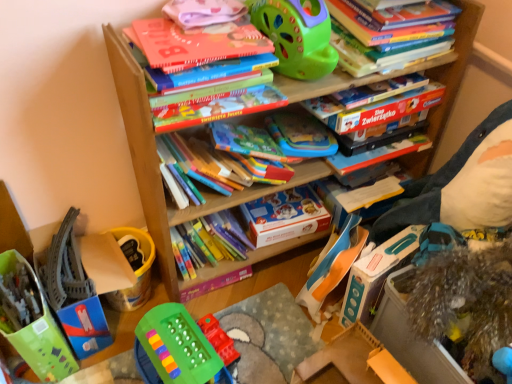
Question: Considering the positions of blue plastic toy at lower right, which is the 5th toy in left-to-right order, and green plastic toy at lower center, which is the fifth toy from right to left, in the image, is blue plastic toy at lower right, which is the 5th toy in left-to-right order, wider or thinner than green plastic toy at lower center, which is the fifth toy from right to left,?

Choices:
 (A) wide
 (B) thin

Answer: (B)

Question: In the image, is blue plastic toy at lower right, which is the 5th toy in left-to-right order, on the left side or the right side of green plastic toy at lower center, which is the fifth toy from right to left?

Choices:
 (A) right
 (B) left

Answer: (A)

Question: Which object is positioned closest to the shiny metallic tinsel at lower right, which ranks as the 6th toy in left-to-right order?

Choices:
 (A) green plastic toy at upper center, placed as the third toy when sorted from right to left
 (B) matte orange book at upper center, acting as the 2th book starting from the top
 (C) wooden toy at lower right
 (D) rubberized plastic toy at center, arranged as the third toy when viewed from the left
 (E) matte cardboard box at center

Answer: (C)

Question: Which of these objects is positioned farthest from the rubberized plastic toy at center, arranged as the third toy when viewed from the left?

Choices:
 (A) green plastic toy at upper center, placed as the third toy when sorted from right to left
 (B) translucent plastic toy at lower left, the 1th toy when ordered from left to right
 (C) matte cardboard book at upper center, marked as the 3th book in a bottom-to-top arrangement
 (D) multicolored plastic crayons at center, which is counted as the 2th book, starting from the bottom
 (E) blue plastic toy at lower right, which is the 5th toy in left-to-right order

Answer: (A)